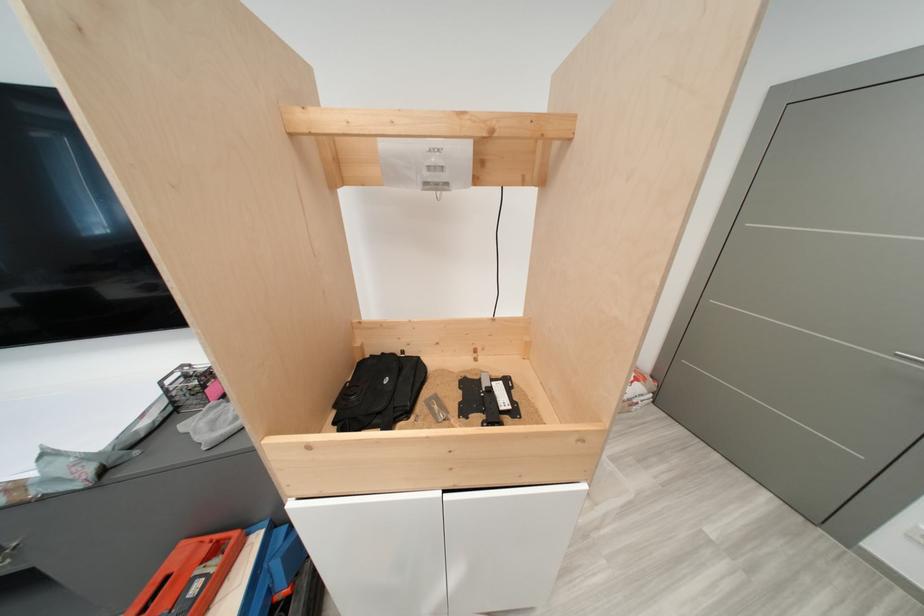
Image resolution: width=924 pixels, height=616 pixels. Describe the element at coordinates (506, 545) in the screenshot. I see `a white cabinet door` at that location.